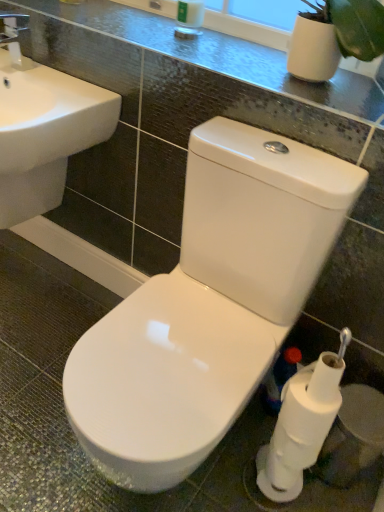
This screenshot has height=512, width=384. What do you see at coordinates (208, 305) in the screenshot?
I see `white glossy toilet at center` at bounding box center [208, 305].

What do you see at coordinates (312, 401) in the screenshot?
I see `white matte toilet paper at lower right, the 2th toilet paper positioned from the bottom` at bounding box center [312, 401].

Find the location of `white glossy toilet at center`. white glossy toilet at center is located at coordinates (208, 305).

Is glossy ceramic counter top at upper center at the back of white glossy toilet at center?

No.

From a real-world perspective, which object stands above the other?

From a 3D spatial view, glossy ceramic counter top at upper center is above.

Between point (268, 261) and point (215, 35), which one is positioned behind?

Positioned behind is point (215, 35).

Can you confirm if white ceramic sink at left is positioned to the right of white matte toilet paper at lower right, the 1th toilet paper viewed from the top?

In fact, white ceramic sink at left is to the left of white matte toilet paper at lower right, the 1th toilet paper viewed from the top.

You are a GUI agent. You are given a task and a screenshot of the screen. Output one action in this format:
    pyautogui.click(x=<x>, y=<y>)
    Task: Click on the toilet paper that is the 1st object directly below the white ceramic sink at left (from a real-world perspective)
    
    Given the screenshot: What is the action you would take?
    pyautogui.click(x=312, y=401)

Could you tell me if white ceramic sink at left is turned towards white matte toilet paper at lower right, the 1th toilet paper viewed from the top?

No, white ceramic sink at left is not aimed at white matte toilet paper at lower right, the 1th toilet paper viewed from the top.

From a real-world perspective, is white ceramic sink at left located higher than white matte toilet paper at lower right, the 2th toilet paper positioned from the bottom?

Yes, from a real-world perspective, white ceramic sink at left is on top of white matte toilet paper at lower right, the 2th toilet paper positioned from the bottom.

Considering the relative sizes of white matte toilet paper at lower right, the 2th toilet paper positioned from the bottom, and white ceramic sink at left in the image provided, is white matte toilet paper at lower right, the 2th toilet paper positioned from the bottom, wider than white ceramic sink at left?

Incorrect, the width of white matte toilet paper at lower right, the 2th toilet paper positioned from the bottom, does not surpass that of white ceramic sink at left.

From the image's perspective, count 1st toilet papers downward from the white ceramic sink at left and point to it. Please provide its 2D coordinates.

[(312, 401)]

From the picture: From a real-world perspective, is white matte toilet paper at lower right, the 1th toilet paper viewed from the top, physically below white ceramic sink at left?

Yes, from a real-world perspective, white matte toilet paper at lower right, the 1th toilet paper viewed from the top, is beneath white ceramic sink at left.

Is white matte toilet paper at lower right, the 2th toilet paper positioned from the bottom, positioned before white ceramic sink at left?

Yes, white matte toilet paper at lower right, the 2th toilet paper positioned from the bottom, is closer to the camera.

Considering the positions of objects white glossy toilet at center and white matte toilet paper at lower right, which is counted as the second toilet paper, starting from the top, in the image provided, who is more to the right, white glossy toilet at center or white matte toilet paper at lower right, which is counted as the second toilet paper, starting from the top,?

white matte toilet paper at lower right, which is counted as the second toilet paper, starting from the top, is more to the right.

Would you say white glossy toilet at center is a long distance from white matte toilet paper at lower right, which is counted as the second toilet paper, starting from the top?

No, white glossy toilet at center is not far away from white matte toilet paper at lower right, which is counted as the second toilet paper, starting from the top.

From the image's perspective, relative to white matte toilet paper at lower right, which is counted as the second toilet paper, starting from the top, is white glossy toilet at center above or below?

white glossy toilet at center is situated higher than white matte toilet paper at lower right, which is counted as the second toilet paper, starting from the top, in the image.

Does white glossy toilet at center have a lesser width compared to white matte toilet paper at lower right, which is counted as the second toilet paper, starting from the top?

In fact, white glossy toilet at center might be wider than white matte toilet paper at lower right, which is counted as the second toilet paper, starting from the top.

Is the surface of glossy ceramic counter top at upper center in direct contact with white ceramic sink at left?

No, glossy ceramic counter top at upper center is not making contact with white ceramic sink at left.

Which is less distant, [244,63] or [95,103]?

Point [244,63].

From the image's perspective, is glossy ceramic counter top at upper center beneath white ceramic sink at left?

Incorrect, from the image's perspective, glossy ceramic counter top at upper center is higher than white ceramic sink at left.

How different are the orientations of white matte toilet paper at lower right, the 2th toilet paper positioned from the bottom, and white matte toilet paper at lower right, which is counted as the 1th toilet paper, starting from the bottom, in degrees?

0 degrees separate the facing orientations of white matte toilet paper at lower right, the 2th toilet paper positioned from the bottom, and white matte toilet paper at lower right, which is counted as the 1th toilet paper, starting from the bottom.

Does white matte toilet paper at lower right, the 1th toilet paper viewed from the top, lie behind white matte toilet paper at lower right, which is counted as the second toilet paper, starting from the top?

No, white matte toilet paper at lower right, the 1th toilet paper viewed from the top, is closer to the viewer.

In the scene shown: Is white matte toilet paper at lower right, the 1th toilet paper viewed from the top, far from white matte toilet paper at lower right, which is counted as the 1th toilet paper, starting from the bottom?

No, there isn't a large distance between white matte toilet paper at lower right, the 1th toilet paper viewed from the top, and white matte toilet paper at lower right, which is counted as the 1th toilet paper, starting from the bottom.

Would you say white matte toilet paper at lower right, the 1th toilet paper viewed from the top, is inside or outside white matte toilet paper at lower right, which is counted as the second toilet paper, starting from the top?

white matte toilet paper at lower right, the 1th toilet paper viewed from the top, lies outside white matte toilet paper at lower right, which is counted as the second toilet paper, starting from the top.

Can you confirm if white ceramic sink at left is positioned to the right of glossy ceramic counter top at upper center?

No.

Which is closer to the camera, (38, 167) or (267, 74)?

Point (38, 167) is farther from the camera than point (267, 74).

How far apart are white ceramic sink at left and glossy ceramic counter top at upper center?

white ceramic sink at left is 13.20 inches from glossy ceramic counter top at upper center.

Considering the sizes of objects white ceramic sink at left and glossy ceramic counter top at upper center in the image provided, who is bigger, white ceramic sink at left or glossy ceramic counter top at upper center?

white ceramic sink at left.

In the image, there is a glossy ceramic counter top at upper center. Identify the location of toilet below it (from a real-world perspective). (208, 305).

The width and height of the screenshot is (384, 512). Find the location of `toilet paper that appears in front of the white ceramic sink at left`. toilet paper that appears in front of the white ceramic sink at left is located at coordinates (312, 401).

Which object lies further to the anchor point glossy ceramic counter top at upper center, white glossy toilet at center or white ceramic sink at left?

white glossy toilet at center is further to glossy ceramic counter top at upper center.

Which object lies further to the anchor point glossy ceramic counter top at upper center, white matte toilet paper at lower right, the 1th toilet paper viewed from the top, or white glossy toilet at center?

white matte toilet paper at lower right, the 1th toilet paper viewed from the top, lies further to glossy ceramic counter top at upper center than the other object.

Estimate the real-world distances between objects in this image. Which object is closer to white glossy toilet at center, white matte toilet paper at lower right, the 1th toilet paper viewed from the top, or glossy ceramic counter top at upper center?

Based on the image, white matte toilet paper at lower right, the 1th toilet paper viewed from the top, appears to be nearer to white glossy toilet at center.

From the image, which object appears to be farther from white matte toilet paper at lower right, which is counted as the second toilet paper, starting from the top, white matte toilet paper at lower right, the 2th toilet paper positioned from the bottom, or white glossy toilet at center?

Based on the image, white glossy toilet at center appears to be further to white matte toilet paper at lower right, which is counted as the second toilet paper, starting from the top.

Estimate the real-world distances between objects in this image. Which object is closer to white matte toilet paper at lower right, the 1th toilet paper viewed from the top, white glossy toilet at center or white matte toilet paper at lower right, which is counted as the 1th toilet paper, starting from the bottom?

Based on the image, white matte toilet paper at lower right, which is counted as the 1th toilet paper, starting from the bottom, appears to be nearer to white matte toilet paper at lower right, the 1th toilet paper viewed from the top.

Based on their spatial positions, is white matte toilet paper at lower right, which is counted as the second toilet paper, starting from the top, or glossy ceramic counter top at upper center closer to white ceramic sink at left?

glossy ceramic counter top at upper center is positioned closer to the anchor white ceramic sink at left.

When comparing their distances from white matte toilet paper at lower right, the 1th toilet paper viewed from the top, does white matte toilet paper at lower right, which is counted as the 1th toilet paper, starting from the bottom, or glossy ceramic counter top at upper center seem further?

glossy ceramic counter top at upper center.

Considering their positions, is white matte toilet paper at lower right, the 1th toilet paper viewed from the top, positioned closer to white ceramic sink at left than white glossy toilet at center?

The object closer to white ceramic sink at left is white glossy toilet at center.

You are a GUI agent. You are given a task and a screenshot of the screen. Output one action in this format:
    pyautogui.click(x=<x>, y=<y>)
    Task: Click on the toilet paper located between white glossy toilet at center and white matte toilet paper at lower right, which is counted as the 1th toilet paper, starting from the bottom, in the depth direction
    The width and height of the screenshot is (384, 512).
    Given the screenshot: What is the action you would take?
    pyautogui.click(x=312, y=401)

I want to click on toilet located between white ceramic sink at left and white matte toilet paper at lower right, which is counted as the second toilet paper, starting from the top, in the left-right direction, so click(x=208, y=305).

Where is `toilet between white ceramic sink at left and white matte toilet paper at lower right, the 2th toilet paper positioned from the bottom, in the horizontal direction`? Image resolution: width=384 pixels, height=512 pixels. toilet between white ceramic sink at left and white matte toilet paper at lower right, the 2th toilet paper positioned from the bottom, in the horizontal direction is located at coordinates 208,305.

Locate an element on the screen. Image resolution: width=384 pixels, height=512 pixels. toilet between glossy ceramic counter top at upper center and white matte toilet paper at lower right, the 1th toilet paper viewed from the top, in the up-down direction is located at coordinates (208, 305).